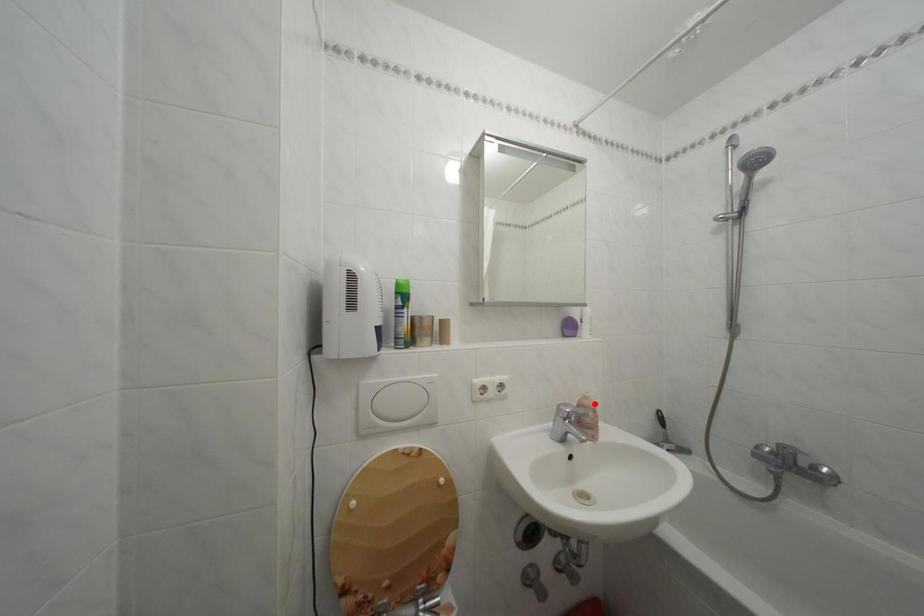
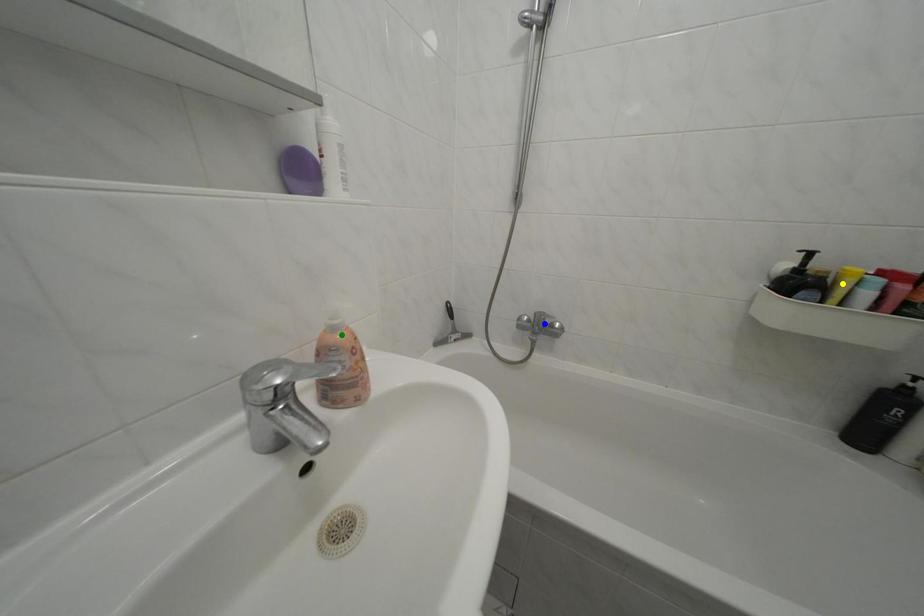
Question: I am providing you with two images of the same scene from different viewpoints. A red point is marked on the first image. You are given multiple points on the second image. Which point in image 2 represents the same 3d spot as the red point in image 1?

Choices:
 (A) yellow point
 (B) green point
 (C) blue point

Answer: (B)